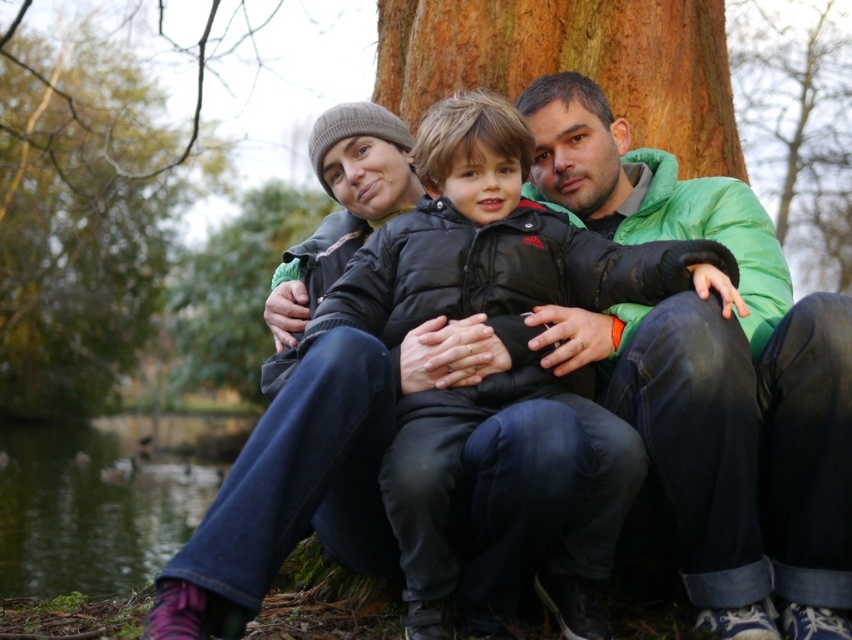
You are a photographer trying to capture the perfect shot of the family. You want to ensure that the black puffer jacket at center is positioned exactly at the center of the image. Based on the coordinates provided, is the jacket already centered?

The black puffer jacket at center is located at coordinates point (496,330), which is slightly off the true center of the image. The true center would be at point (426,320). Therefore, the jacket is not perfectly centered.